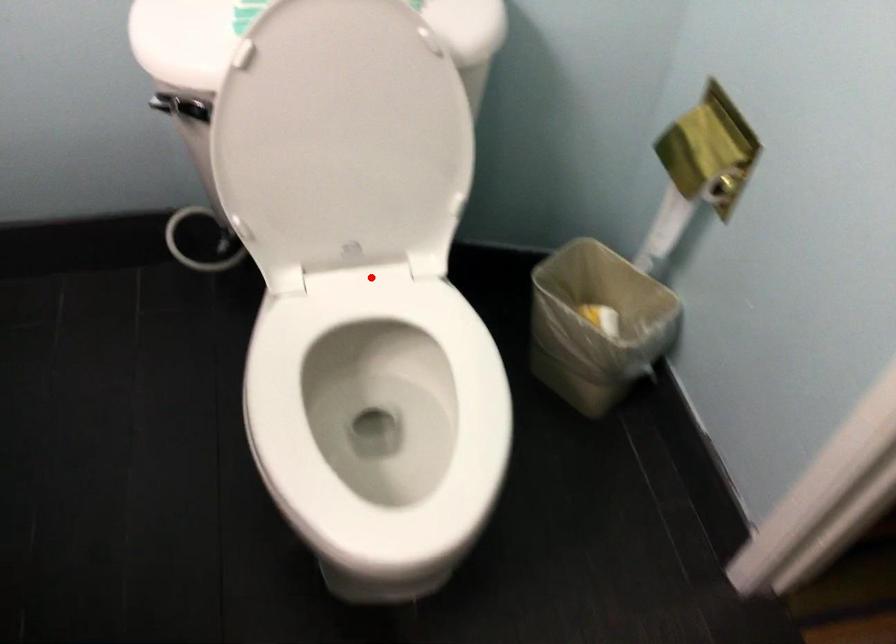
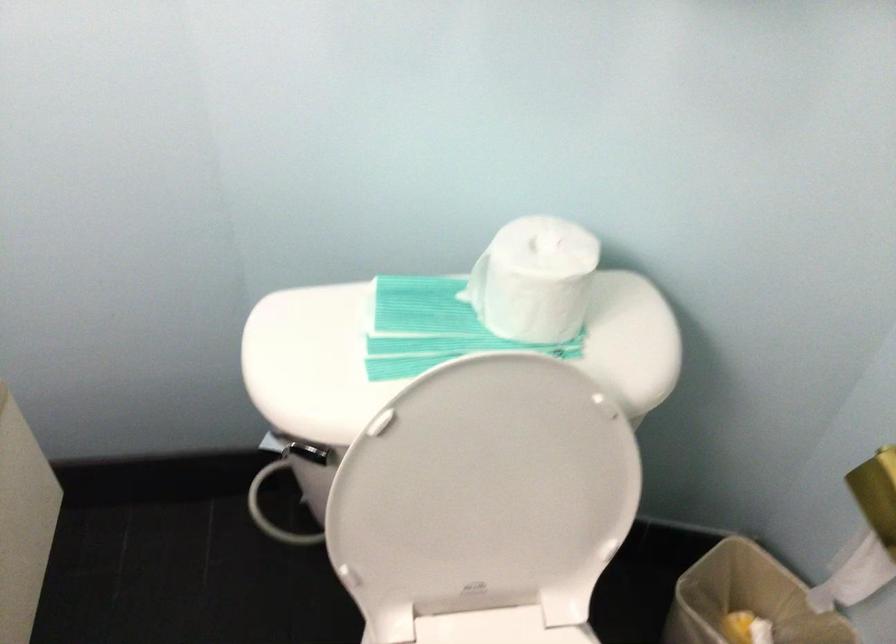
Question: A red point is marked in image1. In image2, is the corresponding 3D point closer to the camera or farther? Reply with the corresponding letter.

Choices:
 (A) The corresponding 3D point is closer.
 (B) The corresponding 3D point is farther.

Answer: (A)